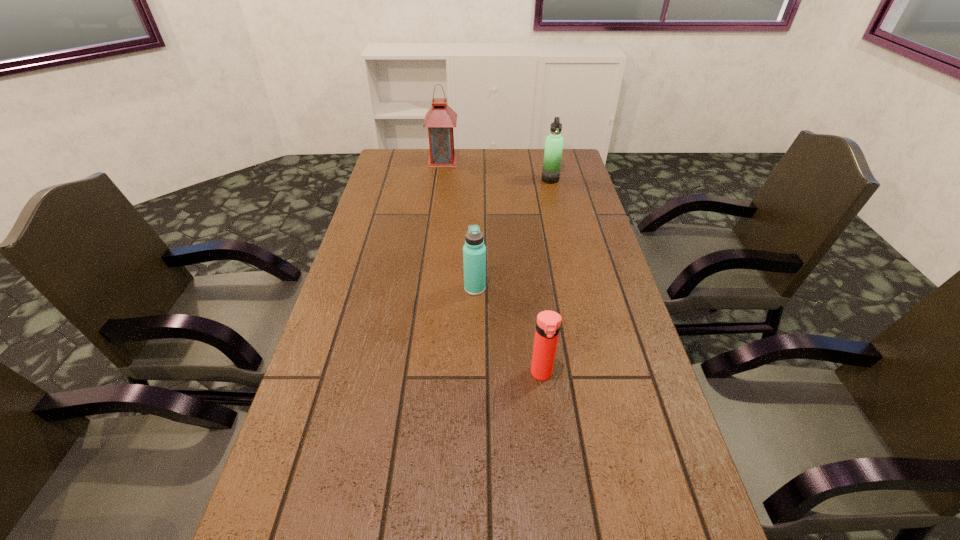
This screenshot has width=960, height=540. In order to click on free space between the tallest object and the nearest object in this screenshot , I will do `click(492, 267)`.

This screenshot has height=540, width=960. In order to click on vacant space that's between the farthest object and the third farthest object in this screenshot , I will do `click(459, 224)`.

In order to click on vacant point located between the third farthest object and the nearest object in this screenshot , I will do `click(508, 331)`.

Locate an element on the screen. vacant area between the leftmost thermos bottle and the tallest object is located at coordinates (459, 224).

Locate an element on the screen. The width and height of the screenshot is (960, 540). vacant point located between the nearest object and the tallest object is located at coordinates (492, 267).

The height and width of the screenshot is (540, 960). Find the location of `empty space that is in between the rightmost thermos bottle and the nearest object`. empty space that is in between the rightmost thermos bottle and the nearest object is located at coordinates (546, 276).

The image size is (960, 540). I want to click on free spot between the tallest object and the rightmost object, so click(496, 170).

Where is `vacant area that lies between the second object from right to left and the leftmost object`? Image resolution: width=960 pixels, height=540 pixels. vacant area that lies between the second object from right to left and the leftmost object is located at coordinates (492, 267).

Identify which object is the second nearest to the farthest object. Please provide its 2D coordinates. Your answer should be formatted as a tuple, i.e. [(x, y)], where the tuple contains the x and y coordinates of a point satisfying the conditions above.

[(474, 251)]

Where is `object that is the third closest to the nearest object`? This screenshot has width=960, height=540. object that is the third closest to the nearest object is located at coordinates (440, 119).